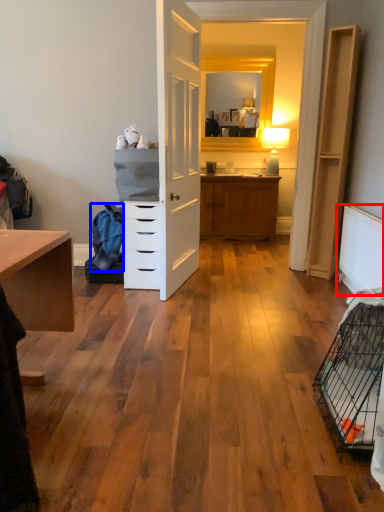
Question: Which object appears farthest to the camera in this image, radiator (highlighted by a red box) or material (highlighted by a blue box)?

Choices:
 (A) radiator
 (B) material

Answer: (B)